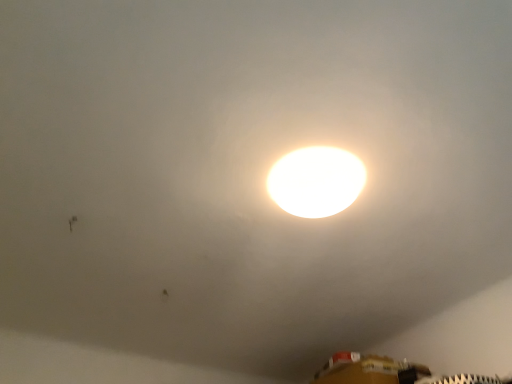
You are a GUI agent. You are given a task and a screenshot of the screen. Output one action in this format:
    pyautogui.click(x=<x>, y=<y>)
    Task: Click on the white glossy lamp at center
    
    Given the screenshot: What is the action you would take?
    pyautogui.click(x=316, y=181)

The height and width of the screenshot is (384, 512). Describe the element at coordinates (316, 181) in the screenshot. I see `white glossy lamp at center` at that location.

In order to face white glossy lamp at center, should I rotate leftwards or rightwards?

A 8.062 degree turn to the right will do.

What is the approximate height of white glossy lamp at center?

3.44 inches.

The height and width of the screenshot is (384, 512). In order to click on white glossy lamp at center in this screenshot , I will do pos(316,181).